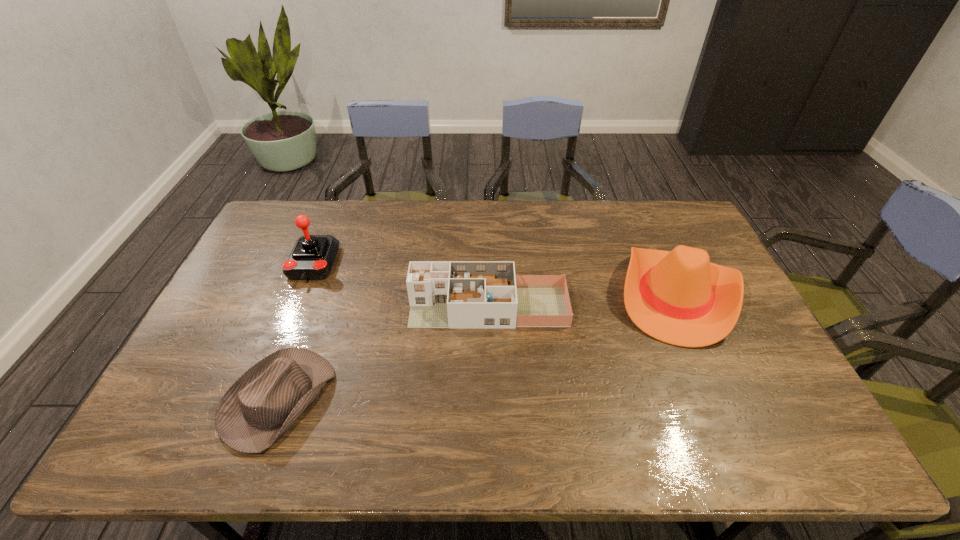
Find the location of `vacant area at the near right corner of the desktop`. vacant area at the near right corner of the desktop is located at coordinates (776, 440).

This screenshot has width=960, height=540. Identify the location of free space between the cowboy hat and the nearest object. click(476, 347).

Locate an element on the screen. The image size is (960, 540). free space between the dollhouse and the cowboy hat is located at coordinates (582, 301).

The height and width of the screenshot is (540, 960). I want to click on free spot between the rightmost object and the nearest object, so click(476, 347).

This screenshot has width=960, height=540. I want to click on free space between the joystick and the third object from left to right, so click(x=401, y=285).

Locate an element on the screen. This screenshot has width=960, height=540. free spot between the fedora and the second object from right to left is located at coordinates (384, 353).

Where is `empty space that is in between the dollhouse and the joystick`? This screenshot has height=540, width=960. empty space that is in between the dollhouse and the joystick is located at coordinates (401, 285).

In order to click on free spot between the cowboy hat and the dollhouse in this screenshot , I will do `click(582, 301)`.

Identify which object is located as the nearest to the cowboy hat. Please provide its 2D coordinates. Your answer should be formatted as a tuple, i.e. [(x, y)], where the tuple contains the x and y coordinates of a point satisfying the conditions above.

[(442, 294)]

Locate an element on the screen. object identified as the second closest to the joystick is located at coordinates (442, 294).